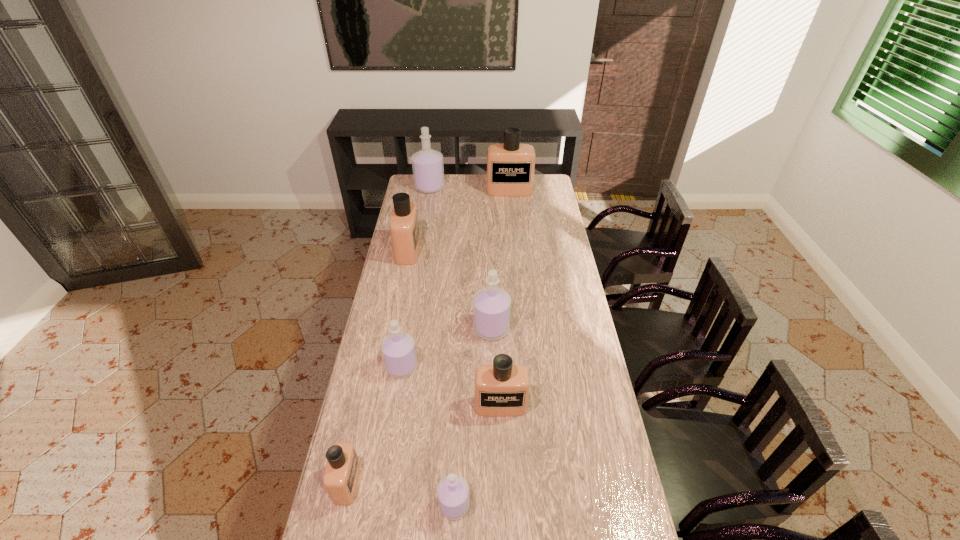
This screenshot has width=960, height=540. I want to click on the nearest beige perfume, so click(x=342, y=470).

The image size is (960, 540). I want to click on the second purple perfume from right to left, so click(452, 491).

You are a GUI agent. You are given a task and a screenshot of the screen. Output one action in this format:
    pyautogui.click(x=<x>, y=<y>)
    Task: Click on the fifth object from left to right
    
    Given the screenshot: What is the action you would take?
    pyautogui.click(x=452, y=491)

Find the location of a particular element. The height and width of the screenshot is (540, 960). free space located on the back of the farthest purple perfume is located at coordinates (432, 175).

This screenshot has height=540, width=960. What are the coordinates of `vacant space situated 0.200m on the front label of the farthest beige perfume` in the screenshot? It's located at (512, 217).

The image size is (960, 540). I want to click on vacant area situated 0.150m on the front label of the third farthest object, so click(450, 251).

The width and height of the screenshot is (960, 540). I want to click on blank space located 0.160m on the front of the third nearest purple perfume, so click(492, 377).

Locate an element on the screen. This screenshot has width=960, height=540. vacant space located 0.380m on the front of the fifth farthest object is located at coordinates (382, 489).

This screenshot has height=540, width=960. What are the coordinates of `vacant position located on the front label of the third nearest object` in the screenshot? It's located at (505, 529).

Locate an element on the screen. The image size is (960, 540). free space located on the front label of the nearest beige perfume is located at coordinates (490, 483).